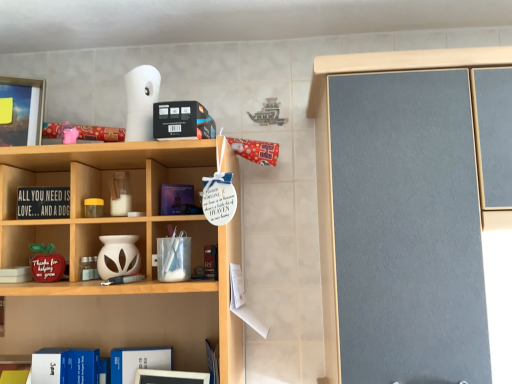
This screenshot has height=384, width=512. I want to click on black wood sign at left, which is counted as the 2th book, starting from the right, so click(42, 202).

What do you see at coordinates (111, 190) in the screenshot?
I see `clear glass jar at center, placed as the 1th cabinet when sorted from top to bottom` at bounding box center [111, 190].

Measure the distance between point (80, 184) and camera.

1.09 meters.

Locate an element on the screen. black wood sign at left, positioned as the first book in left-to-right order is located at coordinates (42, 202).

From the image's perspective, is clear glass jar at center, which appears as the 2th cabinet when ordered from the bottom, over white matte vase at center, marked as the 2th cabinet in a top-to-bottom arrangement?

Yes, from the image's perspective, clear glass jar at center, which appears as the 2th cabinet when ordered from the bottom, is over white matte vase at center, marked as the 2th cabinet in a top-to-bottom arrangement.

Are clear glass jar at center, which appears as the 2th cabinet when ordered from the bottom, and white matte vase at center, marked as the 2th cabinet in a top-to-bottom arrangement, located far from each other?

No, clear glass jar at center, which appears as the 2th cabinet when ordered from the bottom, is not far from white matte vase at center, marked as the 2th cabinet in a top-to-bottom arrangement.

Which of these two, clear glass jar at center, placed as the 1th cabinet when sorted from top to bottom, or white matte vase at center, marked as the first cabinet in a bottom-to-top arrangement, stands taller?

clear glass jar at center, placed as the 1th cabinet when sorted from top to bottom.

Considering the sizes of objects clear glass jar at center, placed as the 1th cabinet when sorted from top to bottom, and blue hardcover book at lower left, arranged as the first book when viewed from the right, in the image provided, who is wider, clear glass jar at center, placed as the 1th cabinet when sorted from top to bottom, or blue hardcover book at lower left, arranged as the first book when viewed from the right,?

With larger width is clear glass jar at center, placed as the 1th cabinet when sorted from top to bottom.

Considering the positions of point (122, 202) and point (157, 347), is point (122, 202) closer or farther from the camera than point (157, 347)?

Point (122, 202).

From the picture: Is clear glass jar at center, which appears as the 2th cabinet when ordered from the bottom, far from blue hardcover book at lower left, acting as the second book starting from the top?

They are positioned close to each other.

From the image's perspective, who appears lower, clear glass jar at center, placed as the 1th cabinet when sorted from top to bottom, or blue hardcover book at lower left, which ranks as the 2th book in left-to-right order?

blue hardcover book at lower left, which ranks as the 2th book in left-to-right order.

Which is further, (24, 201) or (164, 368)?

The point (164, 368) is behind.

Can you confirm if black wood sign at left, positioned as the first book in left-to-right order, is wider than blue hardcover book at lower left, arranged as the first book when viewed from the right?

Incorrect, the width of black wood sign at left, positioned as the first book in left-to-right order, does not surpass that of blue hardcover book at lower left, arranged as the first book when viewed from the right.

Is black wood sign at left, acting as the first book starting from the top, positioned with its back to blue hardcover book at lower left, which ranks as the 2th book in left-to-right order?

No, black wood sign at left, acting as the first book starting from the top,'s orientation is not away from blue hardcover book at lower left, which ranks as the 2th book in left-to-right order.

Is point (133, 252) closer to camera compared to point (106, 179)?

Yes, point (133, 252) is in front of point (106, 179).

How far apart are white matte vase at center, marked as the first cabinet in a bottom-to-top arrangement, and clear glass jar at center, which appears as the 2th cabinet when ordered from the bottom?

9.91 centimeters.

Which of these two, white matte vase at center, marked as the first cabinet in a bottom-to-top arrangement, or clear glass jar at center, placed as the 1th cabinet when sorted from top to bottom, is wider?

With larger width is white matte vase at center, marked as the first cabinet in a bottom-to-top arrangement.

Can you tell me how much white matte vase at center, marked as the first cabinet in a bottom-to-top arrangement, and clear glass jar at center, placed as the 1th cabinet when sorted from top to bottom, differ in facing direction?

The angle between the facing direction of white matte vase at center, marked as the first cabinet in a bottom-to-top arrangement, and the facing direction of clear glass jar at center, placed as the 1th cabinet when sorted from top to bottom, is 2.85 degrees.

Measure the distance between blue hardcover book at lower left, which ranks as the 2th book in left-to-right order, and clear glass jar at center, placed as the 1th cabinet when sorted from top to bottom.

blue hardcover book at lower left, which ranks as the 2th book in left-to-right order, is 16.88 inches from clear glass jar at center, placed as the 1th cabinet when sorted from top to bottom.

Considering the relative sizes of blue hardcover book at lower left, which ranks as the 2th book in left-to-right order, and clear glass jar at center, placed as the 1th cabinet when sorted from top to bottom, in the image provided, is blue hardcover book at lower left, which ranks as the 2th book in left-to-right order, taller than clear glass jar at center, placed as the 1th cabinet when sorted from top to bottom,?

Correct, blue hardcover book at lower left, which ranks as the 2th book in left-to-right order, is much taller as clear glass jar at center, placed as the 1th cabinet when sorted from top to bottom.

Can you tell me how much blue hardcover book at lower left, acting as the first book starting from the bottom, and clear glass jar at center, which appears as the 2th cabinet when ordered from the bottom, differ in facing direction?

4.18 degrees.

From the image's perspective, is blue hardcover book at lower left, which ranks as the 2th book in left-to-right order, over clear glass jar at center, which appears as the 2th cabinet when ordered from the bottom?

No, from the image's perspective, blue hardcover book at lower left, which ranks as the 2th book in left-to-right order, is not over clear glass jar at center, which appears as the 2th cabinet when ordered from the bottom.

Would you say blue hardcover book at lower left, arranged as the first book when viewed from the right, is inside or outside black wood sign at left, which is counted as the 2th book, starting from the right?

blue hardcover book at lower left, arranged as the first book when viewed from the right, is not inside black wood sign at left, which is counted as the 2th book, starting from the right, it's outside.

Locate an element on the screen. Image resolution: width=512 pixels, height=384 pixels. book on the left of blue hardcover book at lower left, arranged as the first book when viewed from the right is located at coordinates (42, 202).

Relative to black wood sign at left, the 2th book in the bottom-to-top sequence, is blue hardcover book at lower left, acting as the second book starting from the top, in front or behind?

Clearly, blue hardcover book at lower left, acting as the second book starting from the top, is behind black wood sign at left, the 2th book in the bottom-to-top sequence.

From the image's perspective, who appears lower, blue hardcover book at lower left, which ranks as the 2th book in left-to-right order, or black wood sign at left, which is counted as the 2th book, starting from the right?

blue hardcover book at lower left, which ranks as the 2th book in left-to-right order, from the image's perspective.

Considering the relative sizes of blue hardcover book at lower left, acting as the second book starting from the top, and white matte vase at center, marked as the 2th cabinet in a top-to-bottom arrangement, in the image provided, is blue hardcover book at lower left, acting as the second book starting from the top, wider than white matte vase at center, marked as the 2th cabinet in a top-to-bottom arrangement,?

No.

Locate an element on the screen. The height and width of the screenshot is (384, 512). book that is on the right side of white matte vase at center, marked as the first cabinet in a bottom-to-top arrangement is located at coordinates (138, 361).

Is point (138, 355) closer to camera compared to point (138, 253)?

That is False.

What are the coordinates of `cabinet beneath the clear glass jar at center, which appears as the 2th cabinet when ordered from the bottom (from a real-world perspective)` in the screenshot? It's located at (110, 249).

This screenshot has width=512, height=384. What are the coordinates of `cabinet that is the 1st object to the left of the blue hardcover book at lower left, arranged as the first book when viewed from the right, starting at the anchor` in the screenshot? It's located at (111, 190).

Looking at the image, which one is located further to blue hardcover book at lower left, acting as the first book starting from the bottom, clear glass jar at center, placed as the 1th cabinet when sorted from top to bottom, or white matte vase at center, marked as the 2th cabinet in a top-to-bottom arrangement?

Based on the image, clear glass jar at center, placed as the 1th cabinet when sorted from top to bottom, appears to be further to blue hardcover book at lower left, acting as the first book starting from the bottom.

When comparing their distances from black wood sign at left, the 2th book in the bottom-to-top sequence, does clear glass jar at center, which appears as the 2th cabinet when ordered from the bottom, or blue hardcover book at lower left, acting as the first book starting from the bottom, seem closer?

clear glass jar at center, which appears as the 2th cabinet when ordered from the bottom, lies closer to black wood sign at left, the 2th book in the bottom-to-top sequence, than the other object.

From the image, which object appears to be nearer to blue hardcover book at lower left, acting as the second book starting from the top, white matte vase at center, marked as the first cabinet in a bottom-to-top arrangement, or black wood sign at left, the 2th book in the bottom-to-top sequence?

white matte vase at center, marked as the first cabinet in a bottom-to-top arrangement, is closer to blue hardcover book at lower left, acting as the second book starting from the top.

Based on their spatial positions, is blue hardcover book at lower left, arranged as the first book when viewed from the right, or white matte vase at center, marked as the 2th cabinet in a top-to-bottom arrangement, further from black wood sign at left, acting as the first book starting from the top?

The object further to black wood sign at left, acting as the first book starting from the top, is blue hardcover book at lower left, arranged as the first book when viewed from the right.

Based on their spatial positions, is blue hardcover book at lower left, arranged as the first book when viewed from the right, or clear glass jar at center, which appears as the 2th cabinet when ordered from the bottom, further from white matte vase at center, marked as the first cabinet in a bottom-to-top arrangement?

blue hardcover book at lower left, arranged as the first book when viewed from the right, lies further to white matte vase at center, marked as the first cabinet in a bottom-to-top arrangement, than the other object.

From the image, which object appears to be nearer to clear glass jar at center, placed as the 1th cabinet when sorted from top to bottom, black wood sign at left, which is counted as the 2th book, starting from the right, or white matte vase at center, marked as the first cabinet in a bottom-to-top arrangement?

white matte vase at center, marked as the first cabinet in a bottom-to-top arrangement, is positioned closer to the anchor clear glass jar at center, placed as the 1th cabinet when sorted from top to bottom.

From the image, which object appears to be nearer to white matte vase at center, marked as the first cabinet in a bottom-to-top arrangement, black wood sign at left, positioned as the first book in left-to-right order, or blue hardcover book at lower left, acting as the second book starting from the top?

Among the two, black wood sign at left, positioned as the first book in left-to-right order, is located nearer to white matte vase at center, marked as the first cabinet in a bottom-to-top arrangement.

When comparing their distances from black wood sign at left, positioned as the first book in left-to-right order, does blue hardcover book at lower left, arranged as the first book when viewed from the right, or clear glass jar at center, placed as the 1th cabinet when sorted from top to bottom, seem closer?

The object closer to black wood sign at left, positioned as the first book in left-to-right order, is clear glass jar at center, placed as the 1th cabinet when sorted from top to bottom.

Where is `book between clear glass jar at center, which appears as the 2th cabinet when ordered from the bottom, and blue hardcover book at lower left, arranged as the first book when viewed from the right, from top to bottom`? book between clear glass jar at center, which appears as the 2th cabinet when ordered from the bottom, and blue hardcover book at lower left, arranged as the first book when viewed from the right, from top to bottom is located at coordinates (42, 202).

Where is `cabinet between clear glass jar at center, placed as the 1th cabinet when sorted from top to bottom, and blue hardcover book at lower left, acting as the first book starting from the bottom, vertically`? The image size is (512, 384). cabinet between clear glass jar at center, placed as the 1th cabinet when sorted from top to bottom, and blue hardcover book at lower left, acting as the first book starting from the bottom, vertically is located at coordinates (110, 249).

Identify the location of cabinet between black wood sign at left, which is counted as the 2th book, starting from the right, and blue hardcover book at lower left, acting as the second book starting from the top, in the up-down direction. This screenshot has width=512, height=384. (110, 249).

Locate an element on the screen. cabinet between black wood sign at left, the 2th book in the bottom-to-top sequence, and clear glass jar at center, placed as the 1th cabinet when sorted from top to bottom, in the horizontal direction is located at coordinates (110, 249).